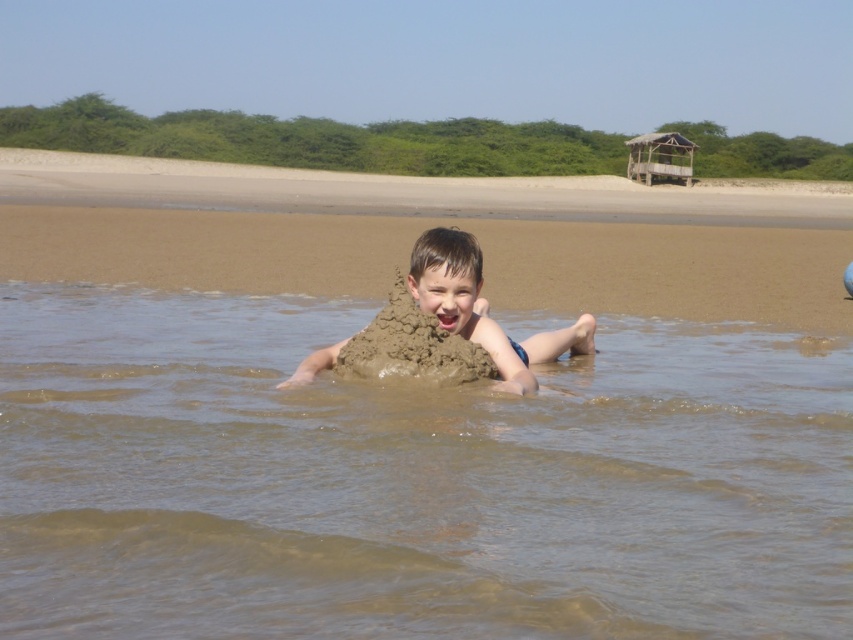
Who is more distant from viewer, (97,468) or (753,305)?

The point (753,305) is behind.

Who is positioned more to the left, brown wet sand at center or brown sandcastle at center?

From the viewer's perspective, brown wet sand at center appears more on the left side.

Which is in front, point (726, 561) or point (608, 275)?

Point (726, 561)

Find the location of a particular element. The image size is (853, 640). brown wet sand at center is located at coordinates (410, 481).

Is point (381, 275) behind point (514, 392)?

Yes.

At what (x,y) coordinates should I click in order to perform the action: click on brown sandcastle at center. Please return your answer as a coordinate pair (x, y). Looking at the image, I should click on point(426,227).

Between point (236, 476) and point (477, 300), which one is positioned behind?

The point (477, 300) is behind.

Locate an element on the screen. Image resolution: width=853 pixels, height=640 pixels. brown wet sand at center is located at coordinates (410, 481).